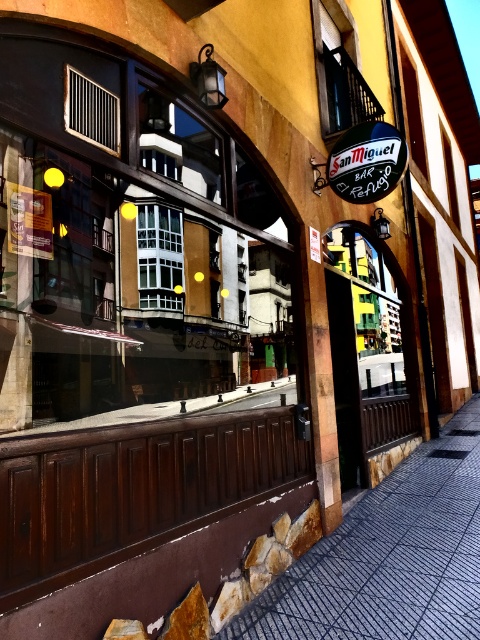
You are standing on the sidewalk and want to touch the point at coordinates point [340,20] on the building. Can you reach it without moving closer?

The point [340,20] is 6.75 meters away from the viewer, so you cannot reach it without moving closer.

Looking at this image, you are a street artist planning to paint a mural on the dark gray textured pavement at lower center and the white glass window at center. Which surface will require more paint due to its size?

The dark gray textured pavement at lower center has a larger size compared to the white glass window at center, so it will require more paint.

You are an architect analyzing the building facade. You notice the matte black window at upper center and the white glass window at center. Which window has a greater height?

The matte black window at upper center is much taller than the white glass window at center, so it has a greater height.